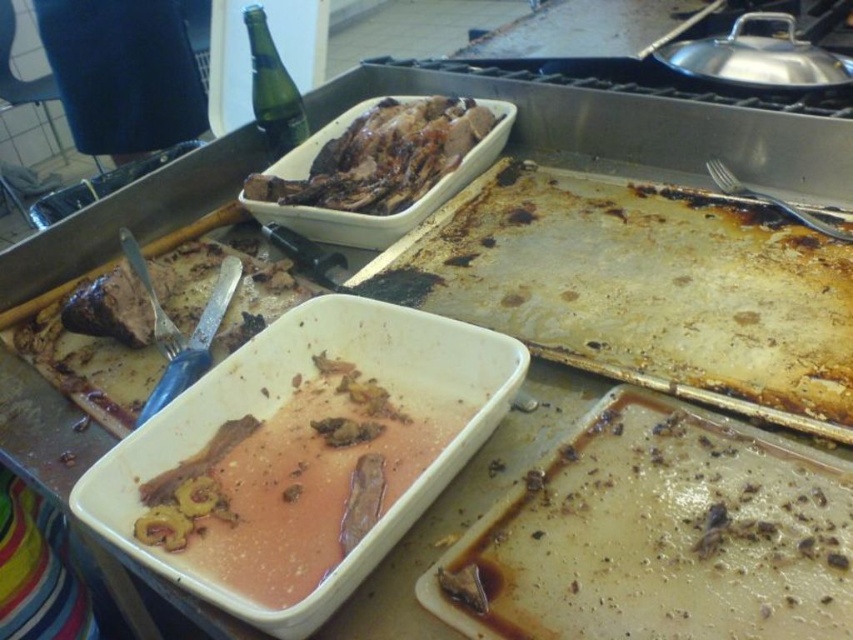
Question: Considering the relative positions of pink glossy sauce at center and brown matte meat at center-left in the image provided, where is pink glossy sauce at center located with respect to brown matte meat at center-left?

Choices:
 (A) left
 (B) right

Answer: (B)

Question: Which is nearer to the green glass bottle at upper left?

Choices:
 (A) brown glazed meat at upper center
 (B) pink glossy sauce at center
 (C) brown matte meat at center-left
 (D) brown matte tray at lower right

Answer: (A)

Question: Which point appears closest to the camera in this image?

Choices:
 (A) (560, 515)
 (B) (392, 154)
 (C) (286, 481)

Answer: (A)

Question: Is brown matte meat at center-left above brown glazed meat at upper center?

Choices:
 (A) no
 (B) yes

Answer: (A)

Question: Does brown matte tray at lower right appear over green glass bottle at upper left?

Choices:
 (A) no
 (B) yes

Answer: (A)

Question: Which of the following is the closest to the observer?

Choices:
 (A) pink glossy sauce at center
 (B) brown glazed meat at upper center
 (C) brown matte meat at center-left

Answer: (A)